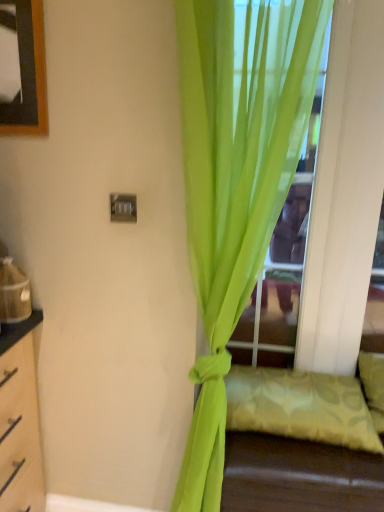
Question: From the image's perspective, is lime green sheer curtain at center on light green fabric pillow at lower right?

Choices:
 (A) yes
 (B) no

Answer: (A)

Question: From a real-world perspective, is lime green sheer curtain at center positioned under light green fabric pillow at lower right based on gravity?

Choices:
 (A) no
 (B) yes

Answer: (A)

Question: Would you consider lime green sheer curtain at center to be distant from light green fabric pillow at lower right?

Choices:
 (A) no
 (B) yes

Answer: (A)

Question: Can you confirm if lime green sheer curtain at center is thinner than light green fabric pillow at lower right?

Choices:
 (A) yes
 (B) no

Answer: (A)

Question: Is lime green sheer curtain at center wider than light green fabric pillow at lower right?

Choices:
 (A) yes
 (B) no

Answer: (B)

Question: Is lime green sheer curtain at center positioned with its back to light green fabric pillow at lower right?

Choices:
 (A) yes
 (B) no

Answer: (A)

Question: Is lime green sheer curtain at center located outside transparent glass door at center?

Choices:
 (A) no
 (B) yes

Answer: (B)

Question: From a real-world perspective, is lime green sheer curtain at center located beneath transparent glass door at center?

Choices:
 (A) yes
 (B) no

Answer: (A)

Question: Can you confirm if lime green sheer curtain at center is thinner than transparent glass door at center?

Choices:
 (A) yes
 (B) no

Answer: (B)

Question: From the image's perspective, would you say lime green sheer curtain at center is shown under transparent glass door at center?

Choices:
 (A) no
 (B) yes

Answer: (B)

Question: Is lime green sheer curtain at center positioned behind transparent glass door at center?

Choices:
 (A) yes
 (B) no

Answer: (B)

Question: Are lime green sheer curtain at center and transparent glass door at center making contact?

Choices:
 (A) yes
 (B) no

Answer: (B)

Question: Is light green fabric pillow at lower right wider than transparent glass door at center?

Choices:
 (A) no
 (B) yes

Answer: (B)